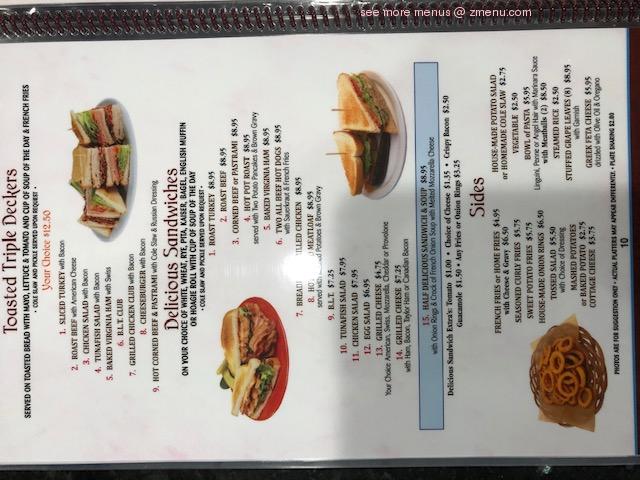
Identify the location of plates. (413, 293), (111, 209), (387, 102).